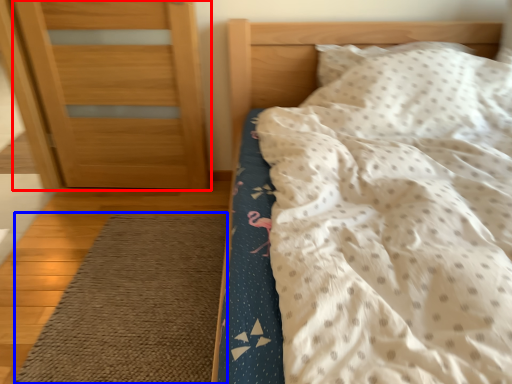
Question: Which point is further to the camera, door (highlighted by a red box) or doormat (highlighted by a blue box)?

Choices:
 (A) door
 (B) doormat

Answer: (A)